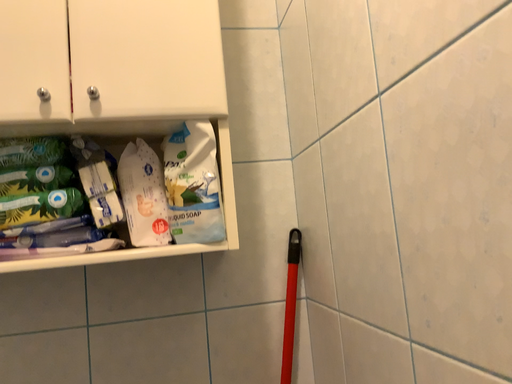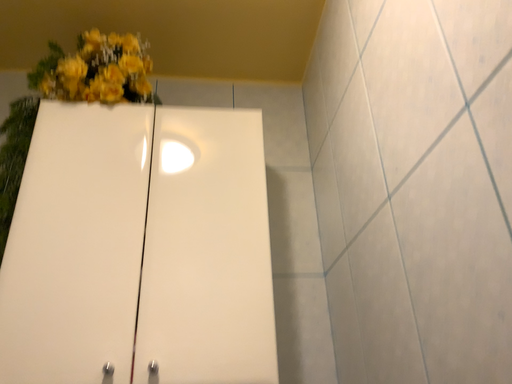
Question: How did the camera likely rotate when shooting the video?

Choices:
 (A) rotated upward
 (B) rotated downward

Answer: (A)